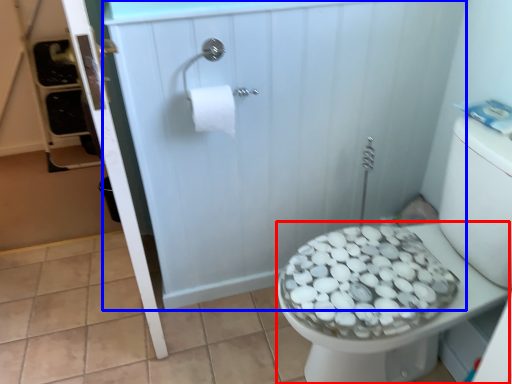
Question: Which of the following is the closest to the observer, bidet (highlighted by a red box) or screen door (highlighted by a blue box)?

Choices:
 (A) bidet
 (B) screen door

Answer: (A)